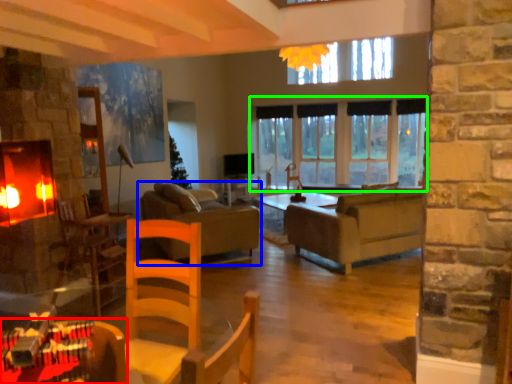
Question: Which object is the closest to the table (highlighted by a red box)? Choose among these: studio couch (highlighted by a blue box) or window (highlighted by a green box).

Choices:
 (A) studio couch
 (B) window

Answer: (A)